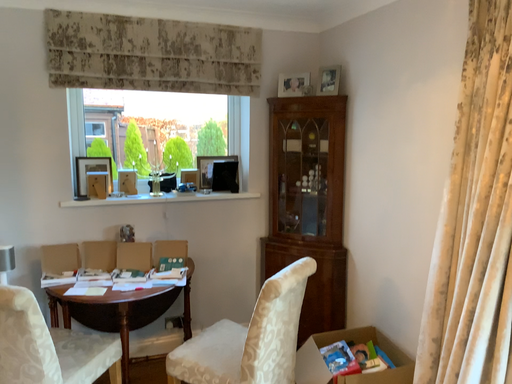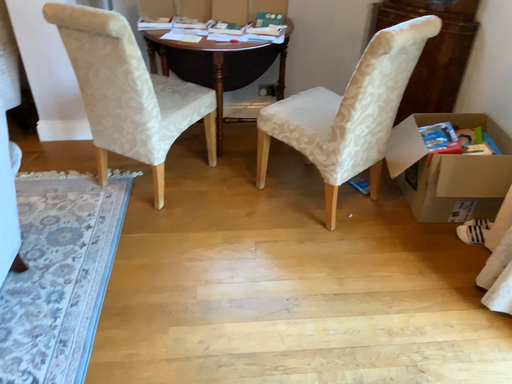
Question: How did the camera likely rotate when shooting the video?

Choices:
 (A) rotated upward
 (B) rotated downward

Answer: (B)